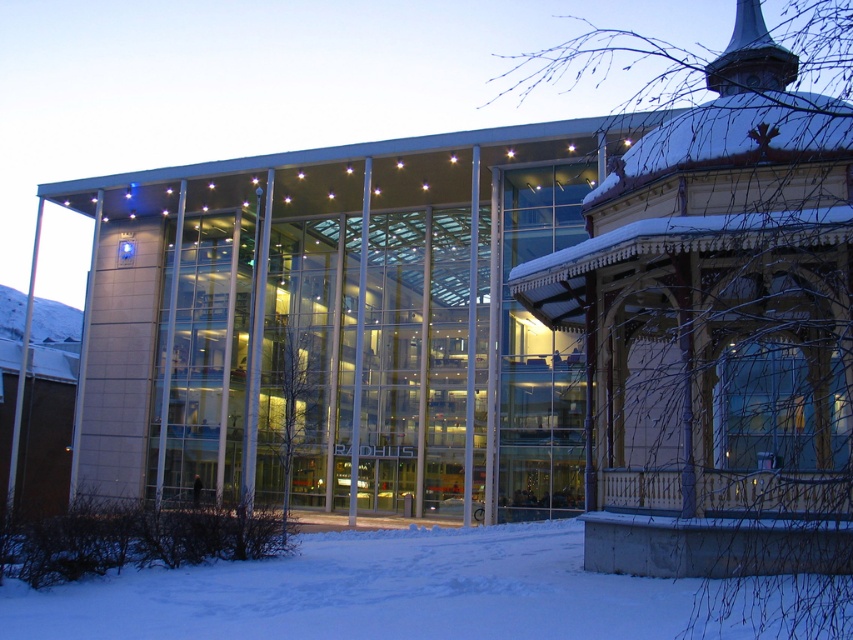
Who is positioned more to the right, wooden gazebo at right or white powdery snow at lower left?

Positioned to the right is wooden gazebo at right.

Looking at this image, does wooden gazebo at right lie in front of white powdery snow at lower left?

That is False.

At what (x,y) coordinates should I click in order to perform the action: click on wooden gazebo at right. Please return your answer as a coordinate pair (x, y). Image resolution: width=853 pixels, height=640 pixels. Looking at the image, I should click on (717, 330).

Identify the location of wooden gazebo at right. The height and width of the screenshot is (640, 853). pyautogui.click(x=717, y=330).